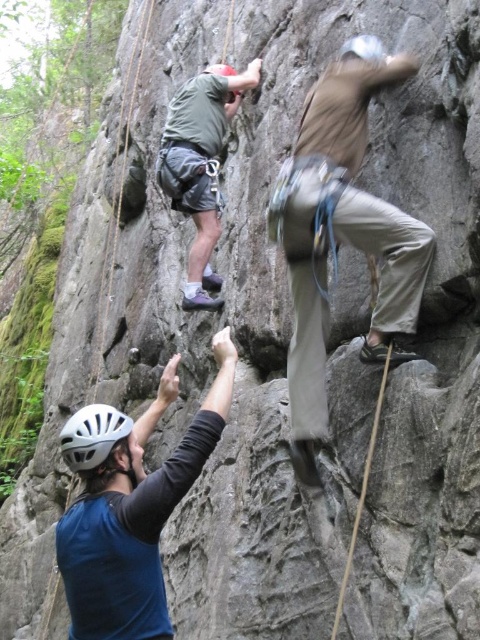
Does khaki cotton pants at center have a smaller size compared to white matte helmet at lower left?

Yes, khaki cotton pants at center is smaller than white matte helmet at lower left.

Can you confirm if khaki cotton pants at center is positioned to the left of white matte helmet at lower left?

In fact, khaki cotton pants at center is to the right of white matte helmet at lower left.

At what (x,y) coordinates should I click in order to perform the action: click on khaki cotton pants at center. Please return your answer as a coordinate pair (x, y). Looking at the image, I should click on (340, 230).

Image resolution: width=480 pixels, height=640 pixels. What are the coordinates of `khaki cotton pants at center` in the screenshot? It's located at (340, 230).

Does green fabric shirt at upper center have a lesser width compared to white matte helmet at lower left?

Indeed, green fabric shirt at upper center has a lesser width compared to white matte helmet at lower left.

Can you confirm if green fabric shirt at upper center is positioned below white matte helmet at lower left?

No.

This screenshot has width=480, height=640. In order to click on green fabric shirt at upper center in this screenshot , I will do tap(201, 164).

Which is below, khaki cotton pants at center or green fabric shirt at upper center?

khaki cotton pants at center is below.

Does khaki cotton pants at center have a larger size compared to green fabric shirt at upper center?

Actually, khaki cotton pants at center might be smaller than green fabric shirt at upper center.

Is point (360, 64) farther from camera compared to point (227, 83)?

No, (360, 64) is in front of (227, 83).

Find the location of `khaki cotton pants at center`. khaki cotton pants at center is located at coordinates (340, 230).